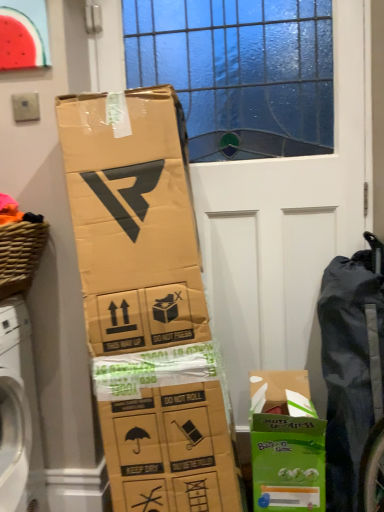
Locate an element on the screen. The height and width of the screenshot is (512, 384). watermelon matte plastic at upper left is located at coordinates (23, 34).

Locate an element on the screen. woven brown basket at left is located at coordinates (20, 255).

The width and height of the screenshot is (384, 512). Identify the location of watermelon matte plastic at upper left. pos(23,34).

Is black fabric bag at right at the back of green cardboard box at lower right?

No, green cardboard box at lower right is not facing away from black fabric bag at right.

Is point (255, 483) more distant than point (343, 284)?

That is False.

Is green cardboard box at lower right far from black fabric bag at right?

green cardboard box at lower right is actually quite close to black fabric bag at right.

Can you confirm if watermelon matte plastic at upper left is positioned to the right of black fabric bag at right?

No, watermelon matte plastic at upper left is not to the right of black fabric bag at right.

Is watermelon matte plastic at upper left thinner than black fabric bag at right?

Correct, the width of watermelon matte plastic at upper left is less than that of black fabric bag at right.

Which is in front, point (48, 42) or point (332, 461)?

The point (48, 42) is more forward.

Would you say black fabric bag at right is to the left or to the right of watermelon matte plastic at upper left in the picture?

Clearly, black fabric bag at right is on the right of watermelon matte plastic at upper left in the image.

From the image's perspective, which is below, black fabric bag at right or watermelon matte plastic at upper left?

black fabric bag at right is shown below in the image.

Between black fabric bag at right and watermelon matte plastic at upper left, which one has more height?

With more height is black fabric bag at right.

Considering the sizes of black fabric bag at right and watermelon matte plastic at upper left in the image, is black fabric bag at right wider or thinner than watermelon matte plastic at upper left?

In the image, black fabric bag at right appears to be wider than watermelon matte plastic at upper left.

Based on the photo, between watermelon matte plastic at upper left and woven brown basket at left, which one has smaller size?

Smaller between the two is watermelon matte plastic at upper left.

Is watermelon matte plastic at upper left behind woven brown basket at left?

Yes, watermelon matte plastic at upper left is further from the camera.

From the image's perspective, is watermelon matte plastic at upper left located above woven brown basket at left?

Indeed, from the image's perspective, watermelon matte plastic at upper left is shown above woven brown basket at left.

Visually, is watermelon matte plastic at upper left positioned to the left or to the right of woven brown basket at left?

In the image, watermelon matte plastic at upper left appears on the left side of woven brown basket at left.

Does point (294, 482) come behind point (1, 25)?

That is False.

From the image's perspective, is green cardboard box at lower right above watermelon matte plastic at upper left?

Actually, green cardboard box at lower right appears below watermelon matte plastic at upper left in the image.

Is green cardboard box at lower right aimed at watermelon matte plastic at upper left?

No, green cardboard box at lower right is not turned towards watermelon matte plastic at upper left.

From a real-world perspective, relative to watermelon matte plastic at upper left, is green cardboard box at lower right vertically above or below?

green cardboard box at lower right is below watermelon matte plastic at upper left.

Can you tell me how much watermelon matte plastic at upper left and green cardboard box at lower right differ in facing direction?

0.291 degrees.

Considering the relative positions of watermelon matte plastic at upper left and green cardboard box at lower right in the image provided, is watermelon matte plastic at upper left in front of green cardboard box at lower right?

No.

Can you confirm if watermelon matte plastic at upper left is thinner than green cardboard box at lower right?

Correct, the width of watermelon matte plastic at upper left is less than that of green cardboard box at lower right.

Is watermelon matte plastic at upper left facing away from green cardboard box at lower right?

watermelon matte plastic at upper left does not have its back to green cardboard box at lower right.

Is woven brown basket at left completely or partially inside green cardboard box at lower right?

No.

How many degrees apart are the facing directions of green cardboard box at lower right and woven brown basket at left?

green cardboard box at lower right and woven brown basket at left are facing 89.8 degrees away from each other.

Where is `cardboard box on the right of the woven brown basket at left`? This screenshot has height=512, width=384. cardboard box on the right of the woven brown basket at left is located at coordinates (286, 444).

Can you confirm if green cardboard box at lower right is positioned to the right of woven brown basket at left?

Indeed, green cardboard box at lower right is positioned on the right side of woven brown basket at left.

Find the location of `cardboard box lying on the left of black fabric bag at right`. cardboard box lying on the left of black fabric bag at right is located at coordinates (286, 444).

You are a GUI agent. You are given a task and a screenshot of the screen. Output one action in this format:
    pyautogui.click(x=<x>, y=<y>)
    Task: Click on the waste directly beneath the watermelon matte plastic at upper left (from a real-world perspective)
    
    Given the screenshot: What is the action you would take?
    pyautogui.click(x=351, y=365)

Estimate the real-world distances between objects in this image. Which object is closer to green cardboard box at lower right, watermelon matte plastic at upper left or woven brown basket at left?

woven brown basket at left is positioned closer to the anchor green cardboard box at lower right.

Looking at this image, based on their spatial positions, is green cardboard box at lower right or black fabric bag at right further from woven brown basket at left?

Based on the image, black fabric bag at right appears to be further to woven brown basket at left.

Considering their positions, is green cardboard box at lower right positioned further to black fabric bag at right than watermelon matte plastic at upper left?

watermelon matte plastic at upper left is further to black fabric bag at right.

Based on their spatial positions, is watermelon matte plastic at upper left or black fabric bag at right further from green cardboard box at lower right?

watermelon matte plastic at upper left is positioned further to the anchor green cardboard box at lower right.

Looking at the image, which one is located closer to watermelon matte plastic at upper left, black fabric bag at right or green cardboard box at lower right?

black fabric bag at right.

In the scene shown: Looking at the image, which one is located further to watermelon matte plastic at upper left, black fabric bag at right or woven brown basket at left?

black fabric bag at right is further to watermelon matte plastic at upper left.

Which object lies further to the anchor point watermelon matte plastic at upper left, green cardboard box at lower right or woven brown basket at left?

green cardboard box at lower right is further to watermelon matte plastic at upper left.

Which object lies nearer to the anchor point woven brown basket at left, black fabric bag at right or watermelon matte plastic at upper left?

The object closer to woven brown basket at left is watermelon matte plastic at upper left.

Where is `basket between watermelon matte plastic at upper left and black fabric bag at right from left to right`? basket between watermelon matte plastic at upper left and black fabric bag at right from left to right is located at coordinates (20, 255).

Locate an element on the screen. The width and height of the screenshot is (384, 512). cardboard box situated between woven brown basket at left and black fabric bag at right from left to right is located at coordinates (286, 444).

The width and height of the screenshot is (384, 512). I want to click on basket between watermelon matte plastic at upper left and green cardboard box at lower right in the vertical direction, so click(x=20, y=255).

This screenshot has height=512, width=384. Identify the location of waste between watermelon matte plastic at upper left and green cardboard box at lower right from top to bottom. (351, 365).